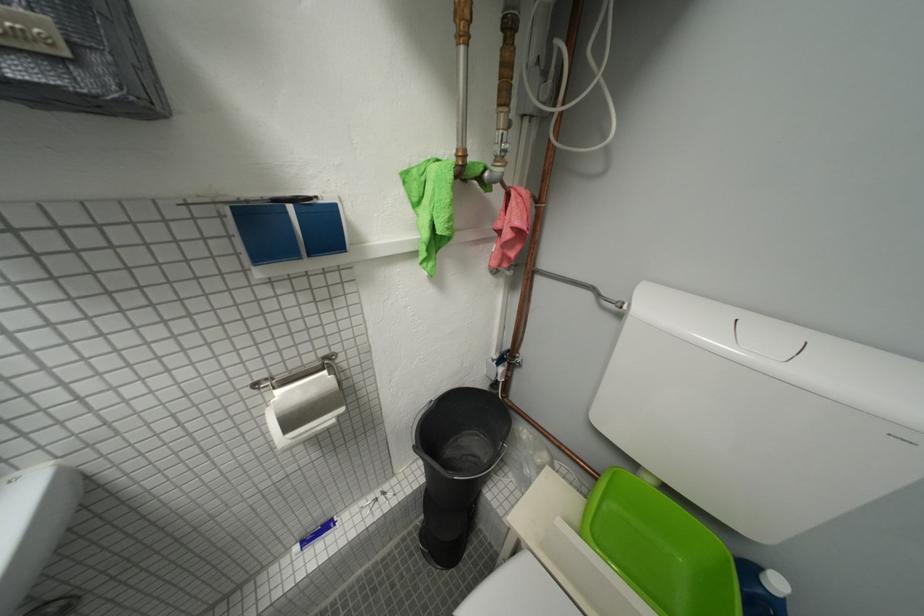
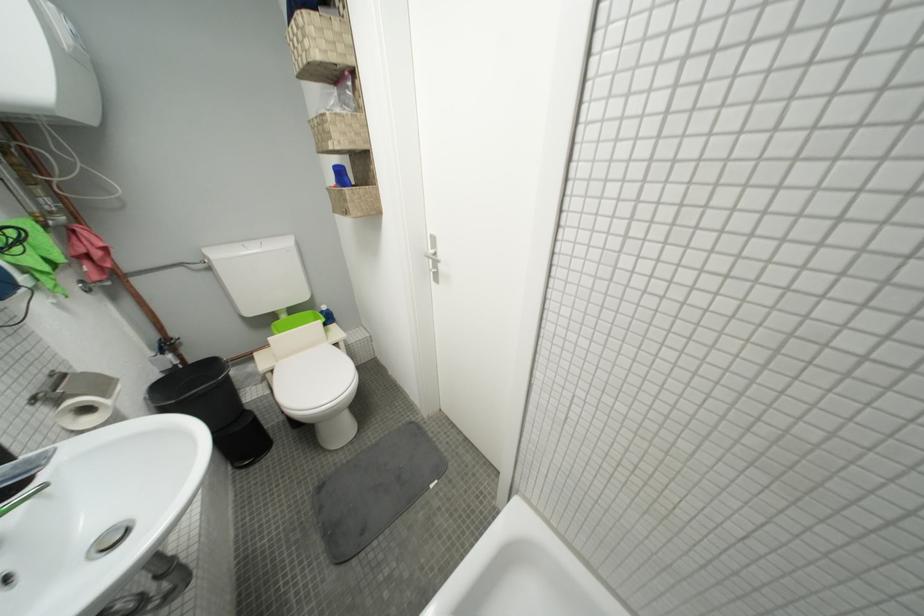
Locate, in the second image, the point that corresponds to (517,361) in the first image.

(175, 347)